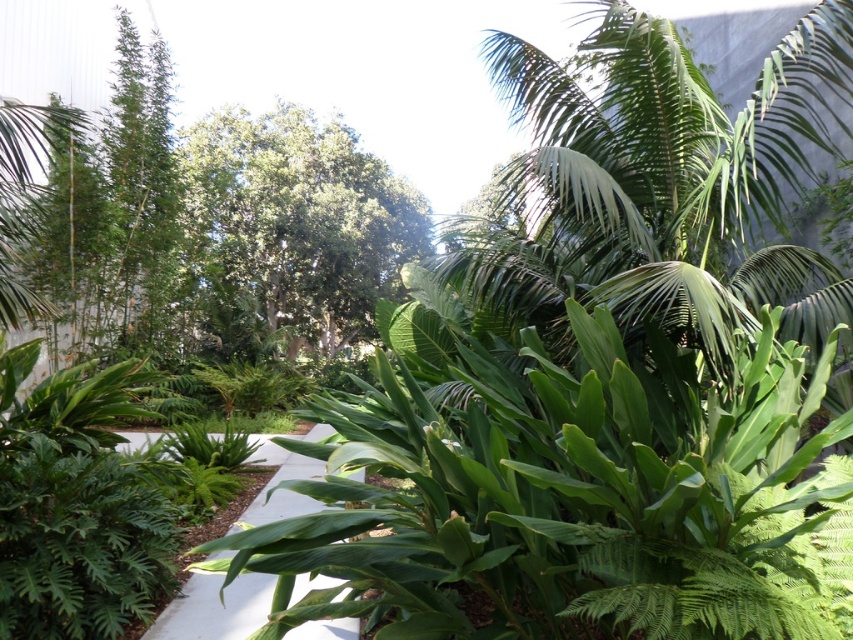
Is green leafy tree at center further to the viewer compared to white concrete path at center?

Yes, it is.

Measure the distance between green leafy tree at center and camera.

They are 40.90 feet apart.

The image size is (853, 640). Describe the element at coordinates (293, 225) in the screenshot. I see `green leafy tree at center` at that location.

Locate an element on the screen. The height and width of the screenshot is (640, 853). green leafy tree at center is located at coordinates (293, 225).